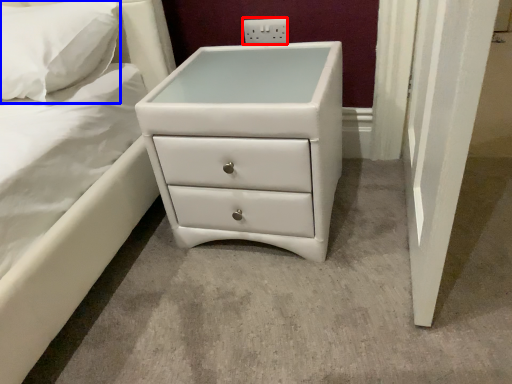
Question: Which of the following is the closest to the observer, electric outlet (highlighted by a red box) or pillow (highlighted by a blue box)?

Choices:
 (A) electric outlet
 (B) pillow

Answer: (B)